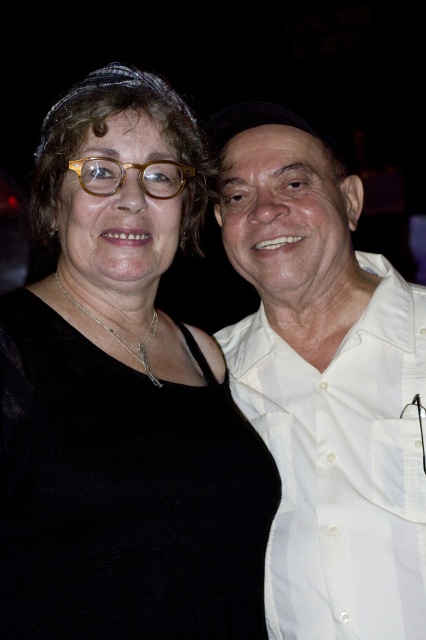
Based on the photo, does black velvet top at center have a lesser width compared to tortoiseshell frame glasses at upper center?

In fact, black velvet top at center might be wider than tortoiseshell frame glasses at upper center.

Does black velvet top at center appear on the left side of tortoiseshell frame glasses at upper center?

Correct, you'll find black velvet top at center to the left of tortoiseshell frame glasses at upper center.

Does point (65, 545) come behind point (147, 163)?

No, it is not.

Where is `black velvet top at center`? The width and height of the screenshot is (426, 640). black velvet top at center is located at coordinates (123, 403).

Who is shorter, black velvet top at center or white cotton shirt at right?

black velvet top at center is shorter.

Who is positioned more to the right, black velvet top at center or white cotton shirt at right?

Positioned to the right is white cotton shirt at right.

Identify the location of black velvet top at center. This screenshot has height=640, width=426. (123, 403).

The image size is (426, 640). In order to click on black velvet top at center in this screenshot , I will do `click(123, 403)`.

Does white cotton shirt at right come in front of tortoiseshell frame glasses at upper center?

That is False.

Consider the image. Who is lower down, white cotton shirt at right or tortoiseshell frame glasses at upper center?

white cotton shirt at right is lower down.

Locate an element on the screen. white cotton shirt at right is located at coordinates (325, 381).

In order to click on white cotton shirt at right in this screenshot , I will do `click(325, 381)`.